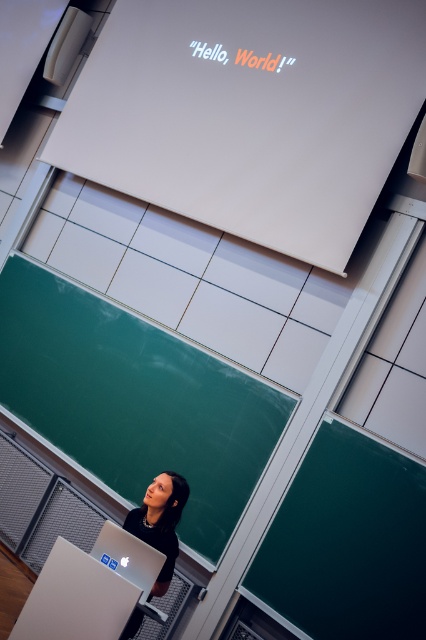
You are standing in the classroom and want to point to the white glossy projector screen at upper center. What are the coordinates where you should aim your finger?

You should aim your finger at the coordinates point (250, 113) to point to the white glossy projector screen at upper center.